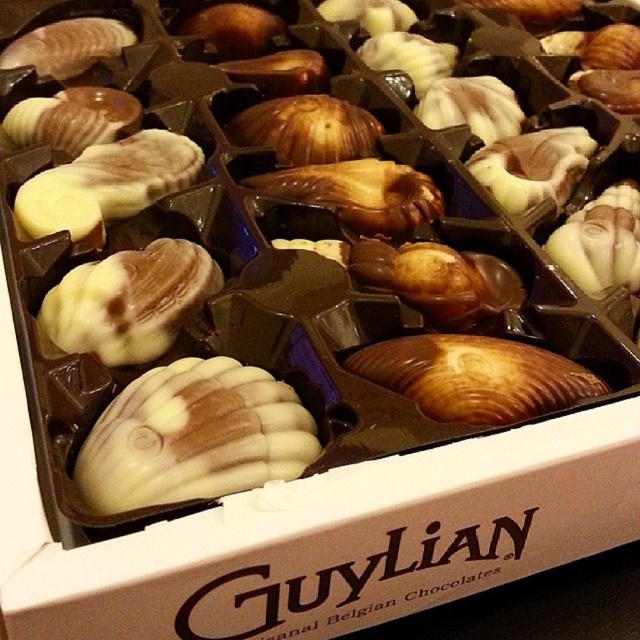
Question: Does white chocolate seashell at center appear under matte brown seashell at center?

Choices:
 (A) yes
 (B) no

Answer: (A)

Question: Does white chocolate seashell at center appear on the right side of matte brown seashell at center?

Choices:
 (A) no
 (B) yes

Answer: (A)

Question: Which point appears farthest from the camera in this image?

Choices:
 (A) (470, 374)
 (B) (200, 362)

Answer: (B)

Question: Among these objects, which one is nearest to the camera?

Choices:
 (A) white chocolate seashell at center
 (B) matte brown seashell at center

Answer: (A)

Question: Does white chocolate seashell at center lie in front of matte brown seashell at center?

Choices:
 (A) yes
 (B) no

Answer: (A)